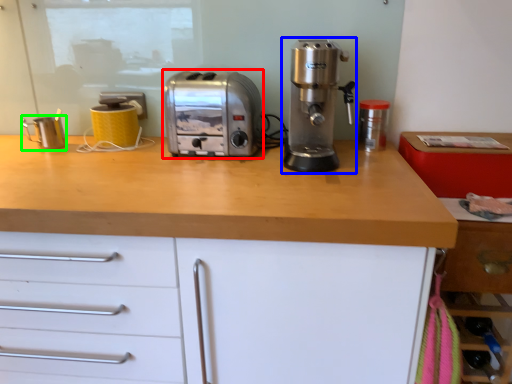
Question: Estimate the real-world distances between objects in this image. Which object is closer to toaster (highlighted by a red box), coffee machine (highlighted by a blue box) or kitchen appliance (highlighted by a green box)?

Choices:
 (A) coffee machine
 (B) kitchen appliance

Answer: (A)